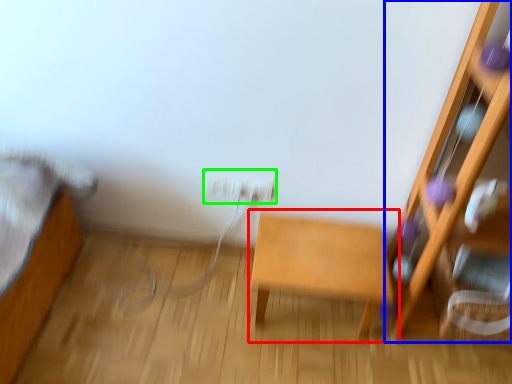
Question: Which object is the closest to the table (highlighted by a red box)? Choose among these: furniture (highlighted by a blue box) or electric outlet (highlighted by a green box).

Choices:
 (A) furniture
 (B) electric outlet

Answer: (B)